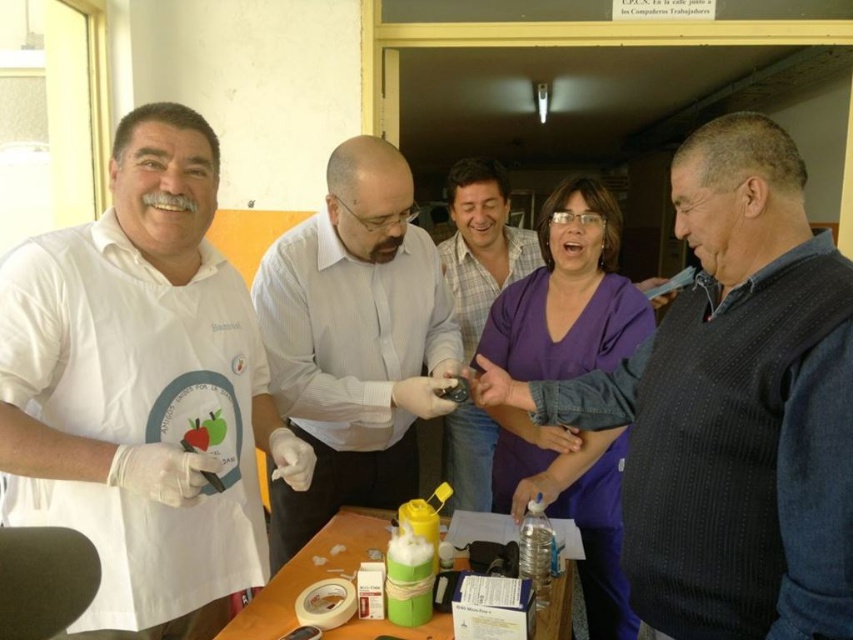
Question: Which object is positioned closest to the white glossy shirt at center?

Choices:
 (A) dark blue sweater at center
 (B) white matte shirt at left
 (C) matte black shirt at center
 (D) green plastic bottle at center

Answer: (D)

Question: Which point is farther to the camera?

Choices:
 (A) (0, 369)
 (B) (463, 458)
 (C) (317, 244)

Answer: (B)

Question: Among these objects, which one is farthest from the camera?

Choices:
 (A) dark blue sweater at center
 (B) white glossy shirt at center
 (C) matte black shirt at center
 (D) white matte shirt at left

Answer: (C)

Question: Is dark blue sweater at center further to camera compared to green plastic bottle at center?

Choices:
 (A) yes
 (B) no

Answer: (B)

Question: Is white matte shirt at left below dark blue sweater at center?

Choices:
 (A) yes
 (B) no

Answer: (A)

Question: Can you confirm if dark blue sweater at center is positioned above white glossy shirt at center?

Choices:
 (A) no
 (B) yes

Answer: (B)